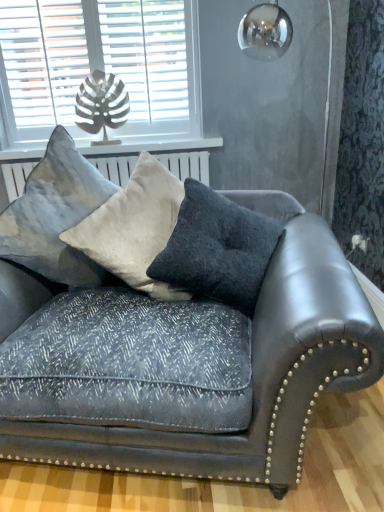
Question: In which direction should I rotate to look at dark gray textured pillow at center, which is the 3th pillow from left to right?

Choices:
 (A) left
 (B) right

Answer: (B)

Question: Does velvet dark gray couch at center lie behind white painted wood at upper left?

Choices:
 (A) yes
 (B) no

Answer: (B)

Question: Does velvet dark gray couch at center appear on the left side of white painted wood at upper left?

Choices:
 (A) no
 (B) yes

Answer: (A)

Question: Is velvet dark gray couch at center in contact with white painted wood at upper left?

Choices:
 (A) yes
 (B) no

Answer: (B)

Question: From the image's perspective, does velvet dark gray couch at center appear lower than white painted wood at upper left?

Choices:
 (A) yes
 (B) no

Answer: (A)

Question: Is velvet dark gray couch at center not inside white painted wood at upper left?

Choices:
 (A) yes
 (B) no

Answer: (A)

Question: From a real-world perspective, is velvet dark gray couch at center located higher than white painted wood at upper left?

Choices:
 (A) no
 (B) yes

Answer: (A)

Question: Is textured velvet pillow at center, the 2th pillow from the right, facing towards white painted wood at upper left?

Choices:
 (A) yes
 (B) no

Answer: (B)

Question: Is textured velvet pillow at center, the 2th pillow from the right, directly adjacent to white painted wood at upper left?

Choices:
 (A) yes
 (B) no

Answer: (B)

Question: Is textured velvet pillow at center, the 2th pillow from the right, to the left of white painted wood at upper left from the viewer's perspective?

Choices:
 (A) no
 (B) yes

Answer: (A)

Question: Is textured velvet pillow at center, the 2th pillow from the right, positioned far away from white painted wood at upper left?

Choices:
 (A) yes
 (B) no

Answer: (B)

Question: Can you confirm if textured velvet pillow at center, the 2th pillow viewed from the left, is smaller than white painted wood at upper left?

Choices:
 (A) yes
 (B) no

Answer: (B)

Question: From the image's perspective, is textured velvet pillow at center, the 2th pillow from the right, under white painted wood at upper left?

Choices:
 (A) no
 (B) yes

Answer: (B)

Question: Is white painted wood at upper left next to white wooden blinds at upper left and touching it?

Choices:
 (A) yes
 (B) no

Answer: (B)